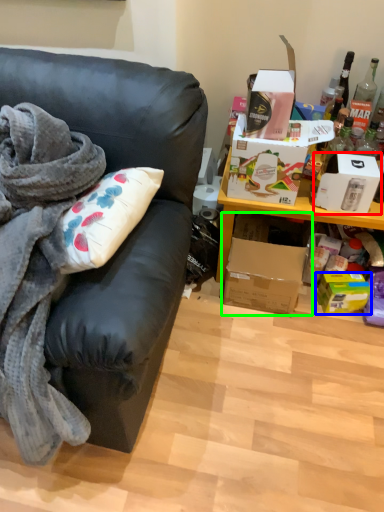
Question: Which object is positioned farthest from box (highlighted by a red box)? Select from box (highlighted by a blue box) and box (highlighted by a green box).

Choices:
 (A) box
 (B) box

Answer: (A)